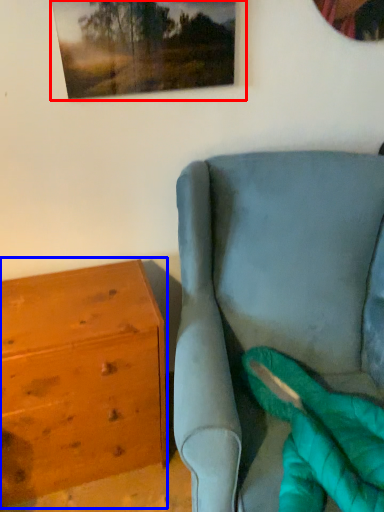
Question: Which point is further to the camera, picture frame (highlighted by a red box) or chest of drawers (highlighted by a blue box)?

Choices:
 (A) picture frame
 (B) chest of drawers

Answer: (B)